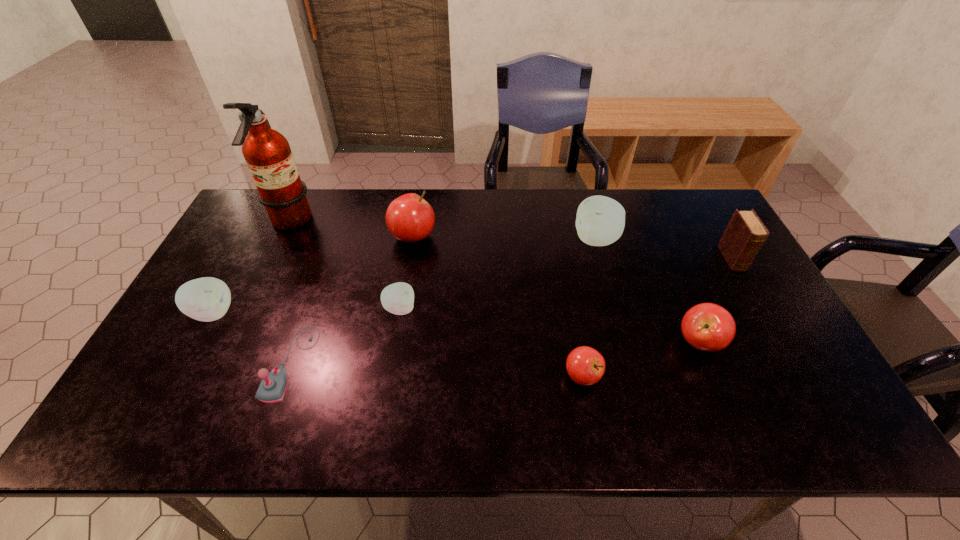
Where is `object at the far left corner`? object at the far left corner is located at coordinates (267, 152).

Identify the location of free spot at the far edge of the desktop. (564, 231).

I want to click on vacant space at the near edge, so click(355, 404).

I want to click on free space at the left edge of the desktop, so click(x=252, y=289).

Identify the location of free space at the right edge. The image size is (960, 540). 686,237.

Locate an element on the screen. free space at the far left corner of the desktop is located at coordinates (241, 218).

The image size is (960, 540). In order to click on vacant space at the far right corner in this screenshot , I will do `click(693, 213)`.

Locate an element on the screen. The image size is (960, 540). free space between the leftmost red apple and the rightmost red apple is located at coordinates point(557,289).

The image size is (960, 540). What are the coordinates of `vacant space that is in between the tallest object and the leftmost red apple` in the screenshot? It's located at (351, 230).

The width and height of the screenshot is (960, 540). Identify the location of free spot between the leftmost apple and the rightmost apple. pyautogui.click(x=456, y=328).